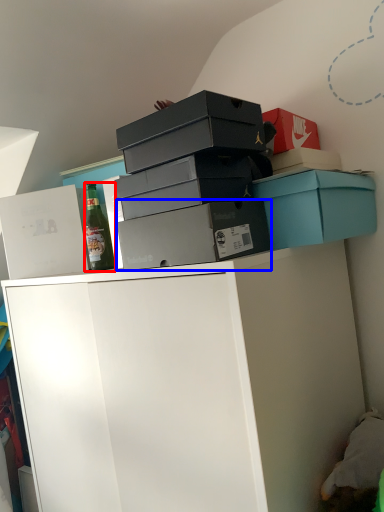
Question: Which object is closer to the camera taking this photo, bottle (highlighted by a red box) or box (highlighted by a blue box)?

Choices:
 (A) bottle
 (B) box

Answer: (B)